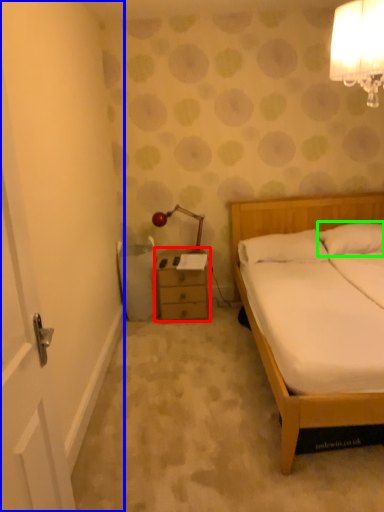
Question: Considering the real-world distances, which object is closest to chest of drawers (highlighted by a red box)? door (highlighted by a blue box) or pillow (highlighted by a green box).

Choices:
 (A) door
 (B) pillow

Answer: (A)